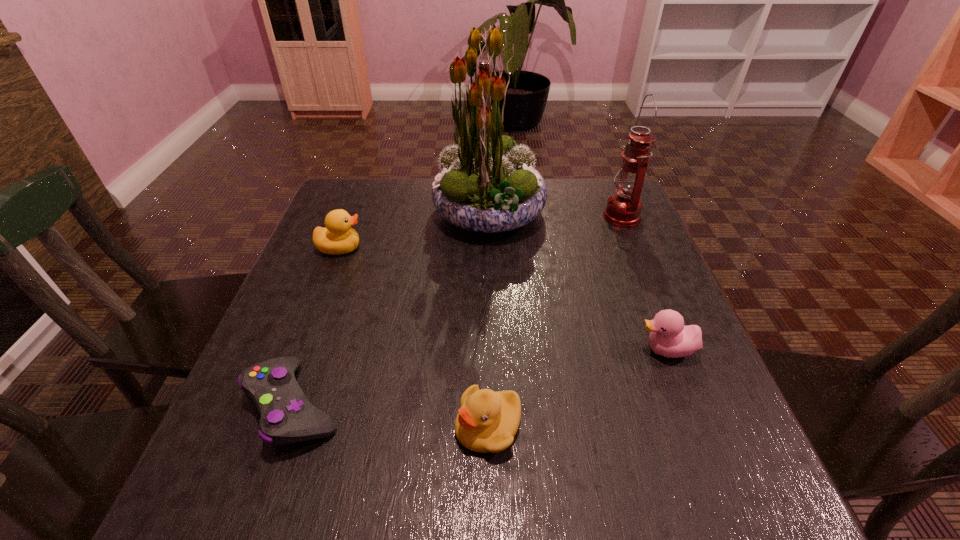
Locate an element on the screen. The height and width of the screenshot is (540, 960). blank space located 0.100m on the face of the farthest duckling is located at coordinates (404, 248).

Identify the location of vacant space located on the front-facing side of the rightmost duckling. The height and width of the screenshot is (540, 960). (516, 350).

Find the location of a particular element. The width and height of the screenshot is (960, 540). free space located on the front-facing side of the rightmost duckling is located at coordinates (542, 350).

Locate an element on the screen. free space located on the front-facing side of the rightmost duckling is located at coordinates point(606,350).

Where is `vacant space located 0.380m on the front-facing side of the second duckling from right to left`? vacant space located 0.380m on the front-facing side of the second duckling from right to left is located at coordinates (222, 426).

Image resolution: width=960 pixels, height=540 pixels. I want to click on free region located 0.230m on the front-facing side of the second duckling from right to left, so click(x=314, y=426).

Identify the location of free region located 0.170m on the front-facing side of the second duckling from right to left. (351, 426).

Where is `vacant space located on the right of the control`? vacant space located on the right of the control is located at coordinates (568, 405).

The width and height of the screenshot is (960, 540). What are the coordinates of `flower arrangement that is at the far edge` in the screenshot? It's located at (488, 184).

Locate an element on the screen. oil lamp that is at the far edge is located at coordinates (623, 209).